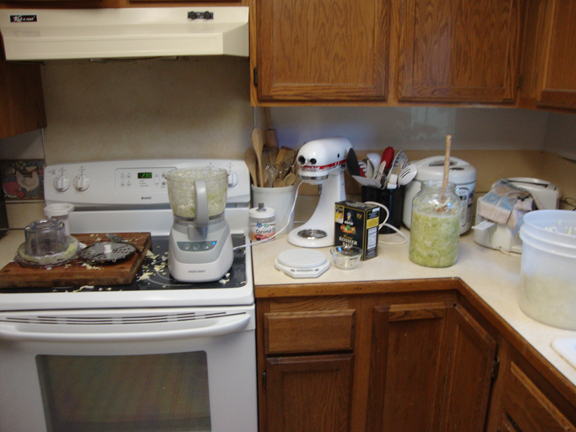
Where is `drawer`? drawer is located at coordinates (313, 326).